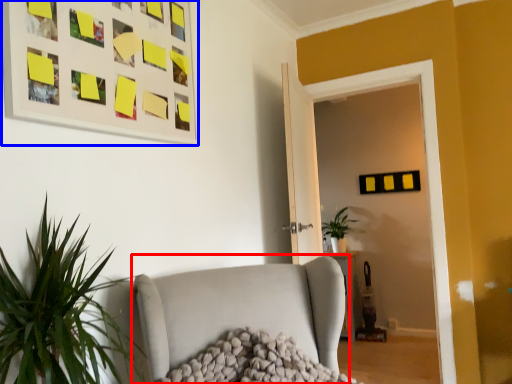
Question: Which object appears closest to the camera in this image, studio couch (highlighted by a red box) or picture frame (highlighted by a blue box)?

Choices:
 (A) studio couch
 (B) picture frame

Answer: (A)